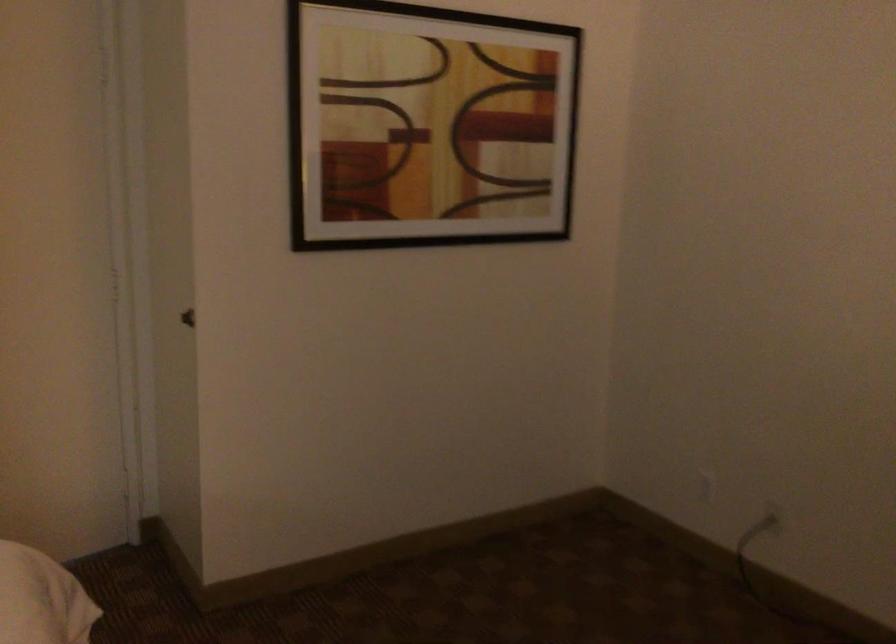
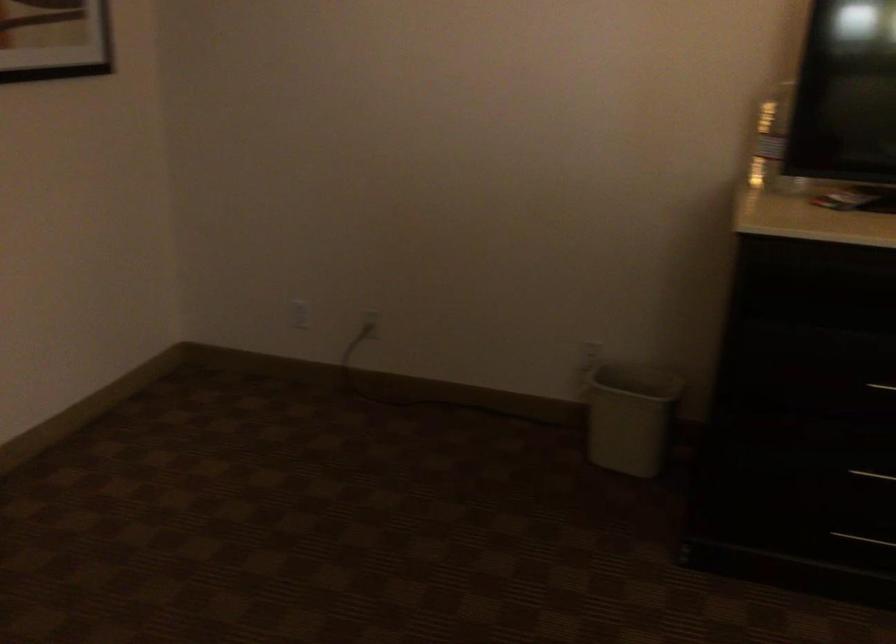
Question: The images are taken continuously from a first-person perspective. In which direction is your viewpoint rotating?

Choices:
 (A) Left
 (B) Right
 (C) Up
 (D) Down

Answer: (B)